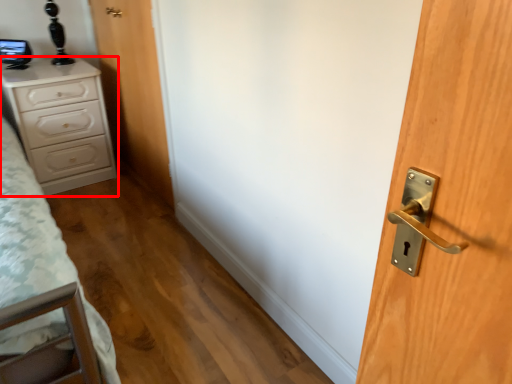
Question: In this image, where is chest of drawers (annotated by the red box) located relative to door?

Choices:
 (A) left
 (B) right

Answer: (A)